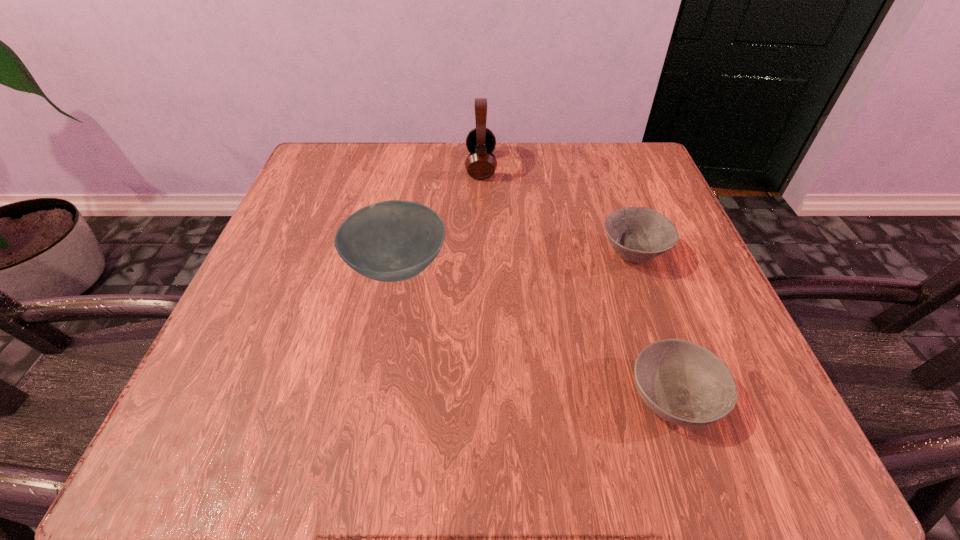
Where is `vacant area located on the back of the third shortest object`? vacant area located on the back of the third shortest object is located at coordinates (419, 148).

The image size is (960, 540). I want to click on vacant space situated 0.310m on the left of the third tallest object, so click(424, 255).

Find the location of a particular element. free space located 0.110m on the back of the nearest object is located at coordinates (641, 300).

The height and width of the screenshot is (540, 960). Find the location of `object located in the far edge section of the desktop`. object located in the far edge section of the desktop is located at coordinates (480, 164).

Identify the location of object situated at the near edge. (682, 382).

Identify the location of object positioned at the left edge. (389, 241).

Find the location of `object that is at the near right corner`. object that is at the near right corner is located at coordinates (682, 382).

The width and height of the screenshot is (960, 540). In order to click on free space at the far edge in this screenshot , I will do `click(516, 194)`.

Find the location of a particular element. free point at the near edge is located at coordinates (392, 400).

Identify the location of vacant region at the left edge of the desktop. (317, 230).